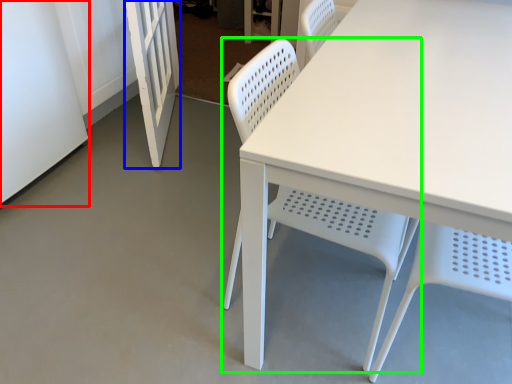
Question: Which object is positioned closest to screen door (highlighted by a red box)? Select from screen door (highlighted by a blue box) and chair (highlighted by a green box).

Choices:
 (A) screen door
 (B) chair

Answer: (A)